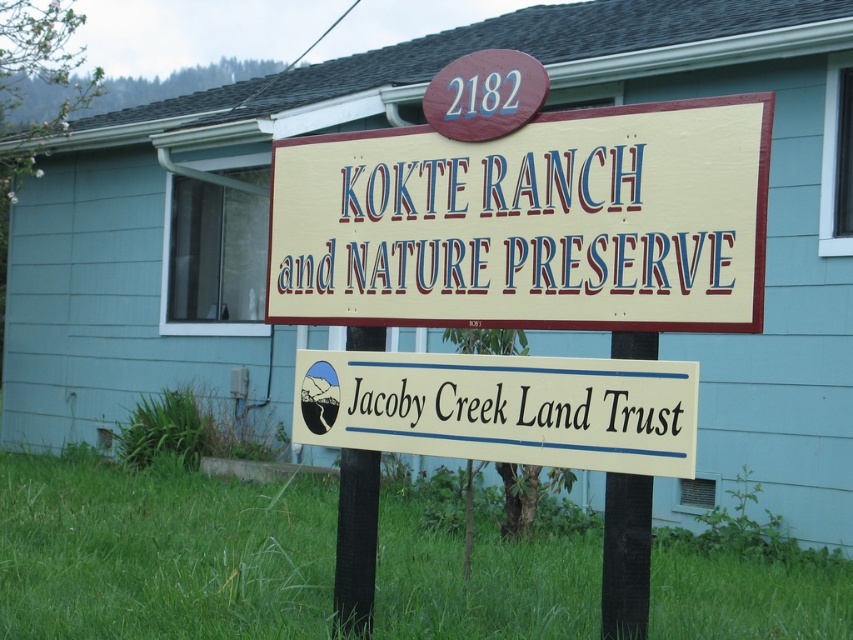
Question: Can you confirm if beige wood sign at center is wider than white painted wood jacoby creek land trust at center?

Choices:
 (A) yes
 (B) no

Answer: (A)

Question: From the image, what is the correct spatial relationship of beige wood sign at center in relation to white painted wood jacoby creek land trust at center?

Choices:
 (A) below
 (B) above

Answer: (B)

Question: Is beige wood sign at center in front of white painted wood jacoby creek land trust at center?

Choices:
 (A) no
 (B) yes

Answer: (B)

Question: Which object appears farthest from the camera in this image?

Choices:
 (A) white painted wood jacoby creek land trust at center
 (B) beige wood sign at center

Answer: (A)

Question: Which point appears closest to the camera in this image?

Choices:
 (A) (363, 404)
 (B) (726, 236)

Answer: (B)